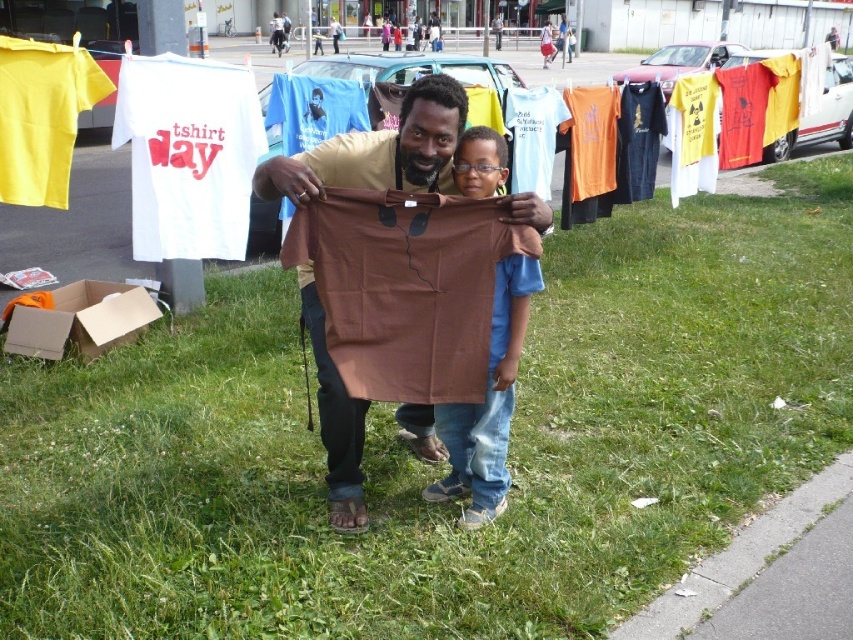
Is brown fabric shirt at center wider than brown cardboard at lower left?

No, brown fabric shirt at center is not wider than brown cardboard at lower left.

Locate an element on the screen. The width and height of the screenshot is (853, 640). brown fabric shirt at center is located at coordinates (488, 403).

Find the location of a particular element. This screenshot has height=640, width=853. brown fabric shirt at center is located at coordinates (488, 403).

Describe the element at coordinates (379, 150) in the screenshot. This screenshot has height=640, width=853. I see `brown matte t-shirt at center` at that location.

Who is positioned more to the right, brown matte t-shirt at center or brown fabric shirt at center?

brown fabric shirt at center

Between point (376, 184) and point (498, 145), which one is positioned in front?

Positioned in front is point (498, 145).

Where is `brown matte t-shirt at center`? brown matte t-shirt at center is located at coordinates (379, 150).

Measure the distance between brown matte t-shirt at center and camera.

The distance of brown matte t-shirt at center from camera is 2.41 meters.

Which is in front, point (445, 179) or point (117, 289)?

Point (445, 179) is in front.

Where is `brown matte t-shirt at center`? brown matte t-shirt at center is located at coordinates point(379,150).